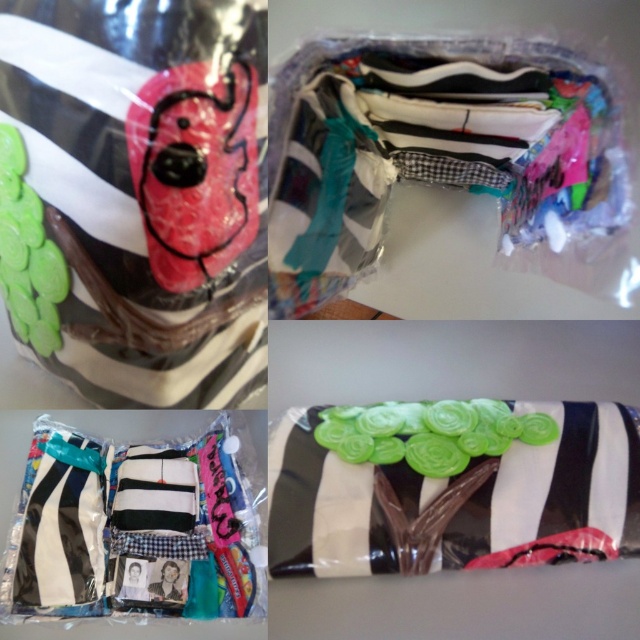
Based on the photo, is matte plastic chocolate cake at upper left bigger than matte black fabric at center?

Indeed, matte plastic chocolate cake at upper left has a larger size compared to matte black fabric at center.

Can you confirm if matte plastic chocolate cake at upper left is positioned above matte black fabric at center?

Indeed, matte plastic chocolate cake at upper left is positioned over matte black fabric at center.

The width and height of the screenshot is (640, 640). Identify the location of matte plastic chocolate cake at upper left. (136, 196).

Describe the element at coordinates (445, 150) in the screenshot. The width and height of the screenshot is (640, 640). I see `matte plastic bag at center` at that location.

Which is above, matte plastic bag at center or matte black fabric at center?

matte plastic bag at center is higher up.

What do you see at coordinates (445, 150) in the screenshot? I see `matte plastic bag at center` at bounding box center [445, 150].

Identify the location of matte plastic bag at center. (445, 150).

Is matte plastic chocolate cake at upper left further to the viewer compared to matte plastic bag at center?

No, it is not.

Who is more forward, (211,140) or (577,108)?

Point (211,140)

Looking at this image, who is more forward, [61,140] or [468,38]?

Point [61,140] is in front.

Find the location of `matte plastic chocolate cake at upper left`. matte plastic chocolate cake at upper left is located at coordinates (136, 196).